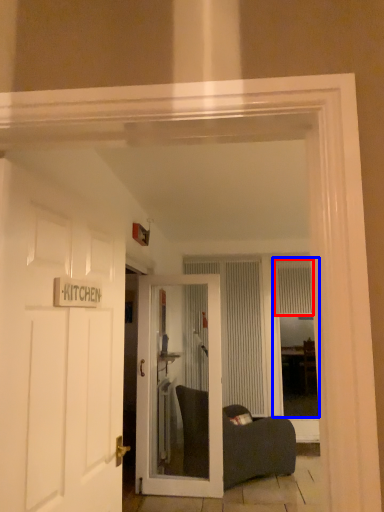
Question: Which object appears farthest to the camera in this image, curtain (highlighted by a red box) or window (highlighted by a blue box)?

Choices:
 (A) curtain
 (B) window

Answer: (A)